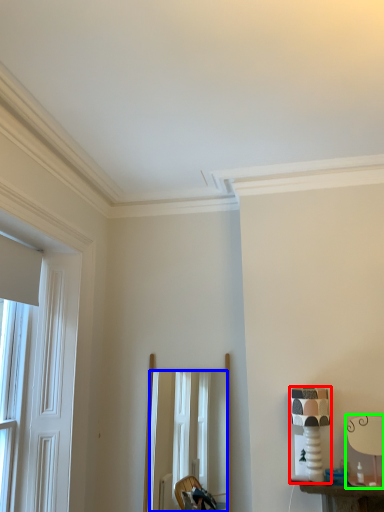
Question: Estimate the real-world distances between objects in this image. Which object is closer to table lamp (highlighted by a red box), mirror (highlighted by a blue box) or table lamp (highlighted by a green box)?

Choices:
 (A) mirror
 (B) table lamp

Answer: (B)